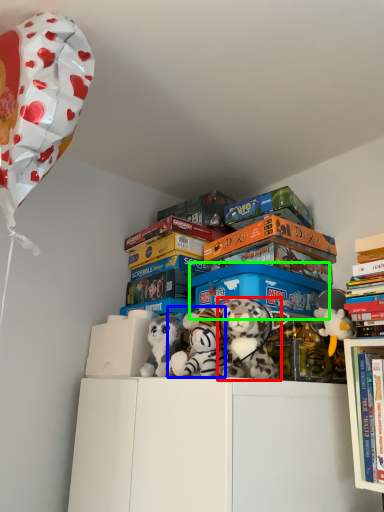
Question: Which is nearer to the toy (highlighted by a red box)? toy (highlighted by a blue box) or storage box (highlighted by a green box).

Choices:
 (A) toy
 (B) storage box

Answer: (A)